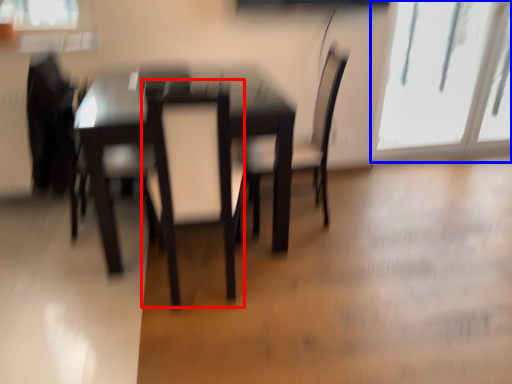
Question: Among these objects, which one is nearest to the camera, swivel chair (highlighted by a red box) or window (highlighted by a blue box)?

Choices:
 (A) swivel chair
 (B) window

Answer: (A)